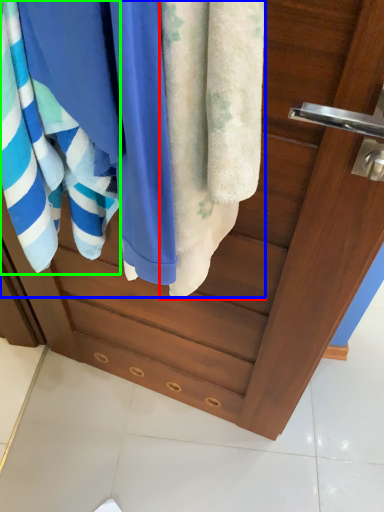
Question: Which object is positioned closest to towel (highlighted by a red box)? Select from beach towel (highlighted by a blue box) and towel (highlighted by a green box).

Choices:
 (A) beach towel
 (B) towel

Answer: (A)